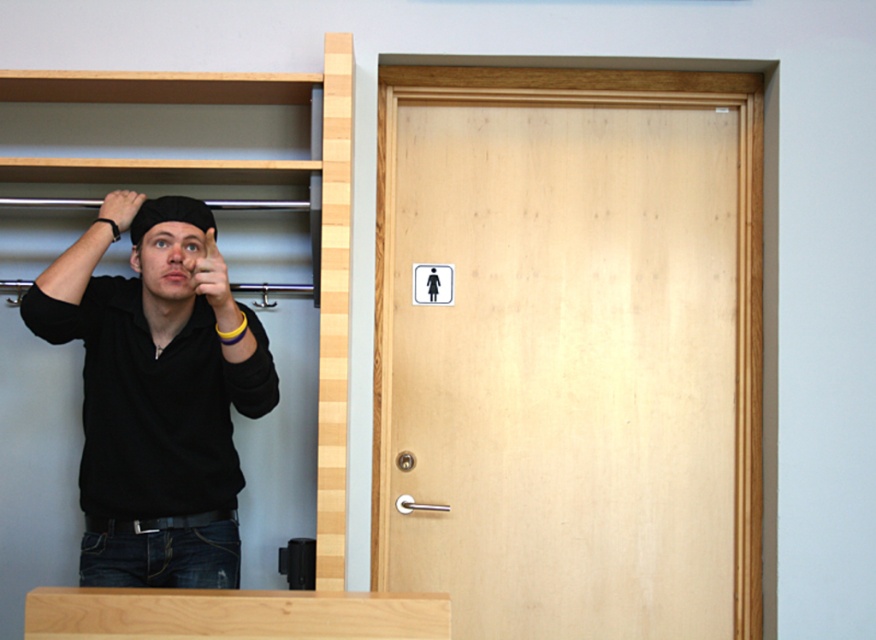
Question: Does matte black hand at upper center have a smaller size compared to black matte wristband at upper left?

Choices:
 (A) yes
 (B) no

Answer: (B)

Question: Estimate the real-world distances between objects in this image. Which object is closer to the matte black hat at upper left?

Choices:
 (A) matte black hand at upper center
 (B) black matte shirt at upper left

Answer: (A)

Question: Is matte black hand at upper center bigger than matte black hat at upper left?

Choices:
 (A) no
 (B) yes

Answer: (B)

Question: Which object is closer to the camera taking this photo?

Choices:
 (A) black matte wristband at upper left
 (B) matte black hat at upper left
 (C) matte black hand at upper center
 (D) black matte shirt at upper left

Answer: (C)

Question: Which point appears farthest from the camera in this image?

Choices:
 (A) (203, 202)
 (B) (131, 189)

Answer: (B)

Question: Observing the image, what is the correct spatial positioning of black matte shirt at upper left in reference to black matte wristband at upper left?

Choices:
 (A) below
 (B) above

Answer: (A)